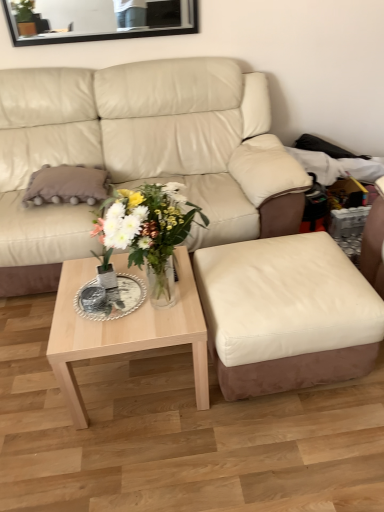
Question: Is there a large distance between leather ottoman at center and clear glass vase at center?

Choices:
 (A) no
 (B) yes

Answer: (A)

Question: Does leather ottoman at center have a greater width compared to clear glass vase at center?

Choices:
 (A) no
 (B) yes

Answer: (B)

Question: Can you confirm if leather ottoman at center is positioned to the left of clear glass vase at center?

Choices:
 (A) yes
 (B) no

Answer: (B)

Question: From the image's perspective, is leather ottoman at center under clear glass vase at center?

Choices:
 (A) yes
 (B) no

Answer: (A)

Question: Is leather ottoman at center located outside clear glass vase at center?

Choices:
 (A) no
 (B) yes

Answer: (B)

Question: Is leather ottoman at center shorter than clear glass vase at center?

Choices:
 (A) yes
 (B) no

Answer: (A)

Question: Does clear glass vase at center have a smaller size compared to black glass mirror at upper center?

Choices:
 (A) no
 (B) yes

Answer: (A)

Question: Is clear glass vase at center placed right next to black glass mirror at upper center?

Choices:
 (A) no
 (B) yes

Answer: (A)

Question: From a real-world perspective, is clear glass vase at center physically above black glass mirror at upper center?

Choices:
 (A) yes
 (B) no

Answer: (B)

Question: Considering the relative sizes of clear glass vase at center and black glass mirror at upper center in the image provided, is clear glass vase at center wider than black glass mirror at upper center?

Choices:
 (A) no
 (B) yes

Answer: (B)

Question: Is black glass mirror at upper center inside clear glass vase at center?

Choices:
 (A) no
 (B) yes

Answer: (A)

Question: Can you confirm if clear glass vase at center is bigger than black glass mirror at upper center?

Choices:
 (A) yes
 (B) no

Answer: (A)

Question: Is beige leather couch at center aimed at leather ottoman at center?

Choices:
 (A) yes
 (B) no

Answer: (A)